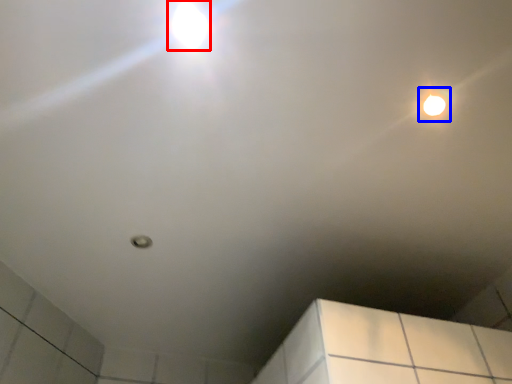
Question: Which object is closer to the camera taking this photo, droplight (highlighted by a red box) or droplight (highlighted by a blue box)?

Choices:
 (A) droplight
 (B) droplight

Answer: (A)